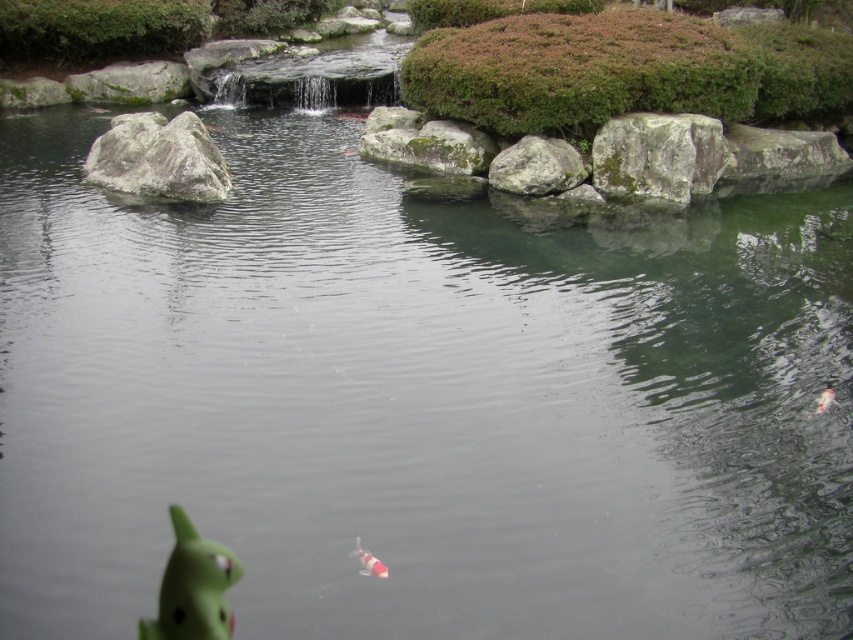
Question: Considering the relative positions of green rubber toy at lower left and green mossy rock at upper left in the image provided, where is green rubber toy at lower left located with respect to green mossy rock at upper left?

Choices:
 (A) right
 (B) left

Answer: (A)

Question: Considering the real-world distances, which object is closest to the gray rough rock at upper right?

Choices:
 (A) shiny orange fish at center
 (B) gray rough rock at center
 (C) gray rough rock at right
 (D) green mossy rock at upper left

Answer: (B)

Question: Which of the following is the closest to the observer?

Choices:
 (A) gray rough rock at left
 (B) green mossy rock at upper left

Answer: (A)

Question: Which object is closer to the camera taking this photo?

Choices:
 (A) shiny orange fish at center
 (B) gray rough rock at upper right

Answer: (A)

Question: From the image, what is the correct spatial relationship of gray rough rock at center in relation to shiny orange fish at center?

Choices:
 (A) left
 (B) right

Answer: (B)

Question: Is gray rough rock at left smaller than white glossy fish at lower right?

Choices:
 (A) yes
 (B) no

Answer: (B)